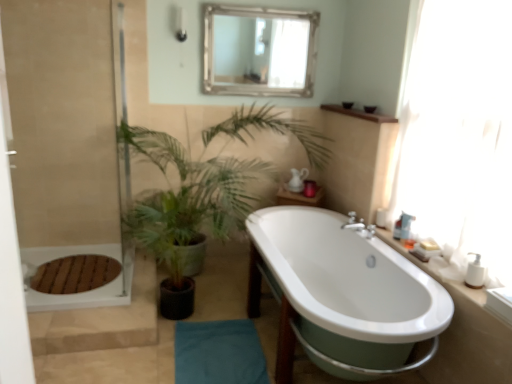
The width and height of the screenshot is (512, 384). In order to click on vacant space behind beige textured screen door at left in this screenshot , I will do `click(92, 278)`.